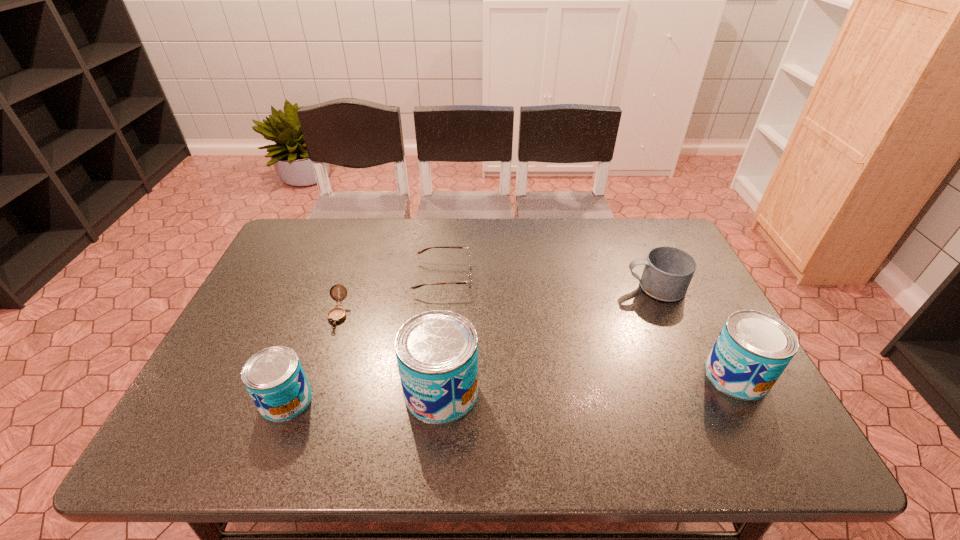
Locate an element on the screen. can that is the third closest to the compass is located at coordinates (753, 349).

You are a GUI agent. You are given a task and a screenshot of the screen. Output one action in this format:
    pyautogui.click(x=<x>, y=<y>)
    Task: Click on the closest can to the fourth shortest object
    The width and height of the screenshot is (960, 540).
    Given the screenshot: What is the action you would take?
    pyautogui.click(x=437, y=351)

The height and width of the screenshot is (540, 960). I want to click on vacant space that satisfies the following two spatial constraints: 1. on the face of the compass; 2. on the right side of the tallest can, so coord(312,392).

At what (x,y) coordinates should I click in order to perform the action: click on vacant region that satisfies the following two spatial constraints: 1. on the front-facing side of the spectacles; 2. on the face of the compass. Please return your answer as a coordinate pair (x, y). The height and width of the screenshot is (540, 960). Looking at the image, I should click on (440, 314).

This screenshot has height=540, width=960. What are the coordinates of `free spot that satisfies the following two spatial constraints: 1. on the side of the third shortest object with the handle; 2. on the face of the compass` in the screenshot? It's located at (666, 314).

Locate an element on the screen. The width and height of the screenshot is (960, 540). vacant space that satisfies the following two spatial constraints: 1. on the back side of the rightmost can; 2. on the side of the mug with the handle is located at coordinates (690, 287).

The width and height of the screenshot is (960, 540). I want to click on free spot that satisfies the following two spatial constraints: 1. on the back side of the second shortest can; 2. on the side of the fourth tallest object with the handle, so click(x=690, y=287).

This screenshot has width=960, height=540. What are the coordinates of `vacant space that satisfies the following two spatial constraints: 1. on the back side of the fourth shortest object; 2. on the right side of the rightmost can` in the screenshot? It's located at (296, 375).